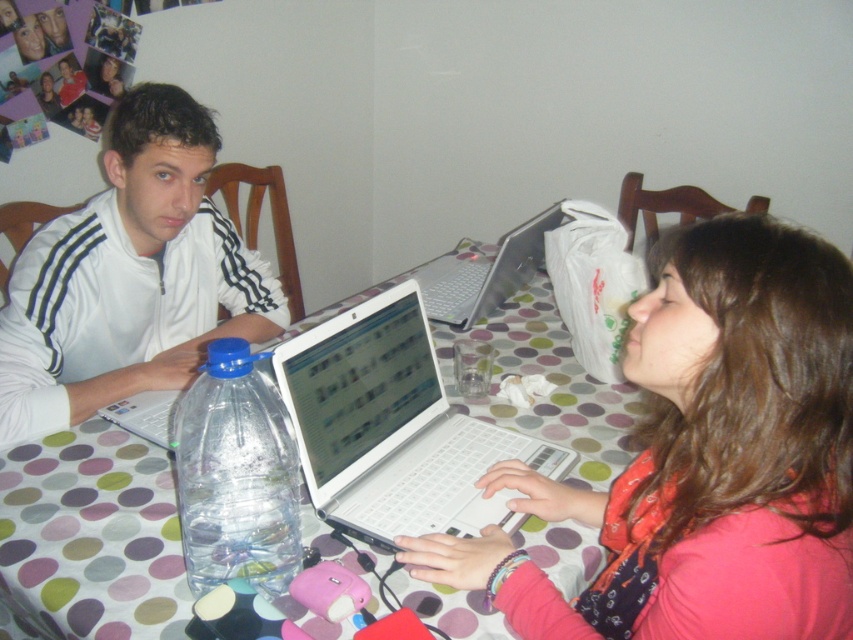
Question: Is matte white laptop at center behind polka dot fabric table at center?

Choices:
 (A) no
 (B) yes

Answer: (A)

Question: Can you confirm if white matte jacket at upper left is smaller than white plastic laptop at center?

Choices:
 (A) no
 (B) yes

Answer: (A)

Question: Which point is farther to the camera?

Choices:
 (A) (123, 168)
 (B) (465, 276)

Answer: (B)

Question: Does white matte jacket at upper left have a lesser width compared to white glossy laptop at center?

Choices:
 (A) yes
 (B) no

Answer: (B)

Question: Estimate the real-world distances between objects in this image. Which object is farther from the clear plastic bottle at center?

Choices:
 (A) polka dot fabric table at center
 (B) white matte jacket at upper left
 (C) white glossy laptop at center

Answer: (C)

Question: Which point is closer to the camera?

Choices:
 (A) (845, 474)
 (B) (35, 476)
 (C) (177, 404)

Answer: (A)